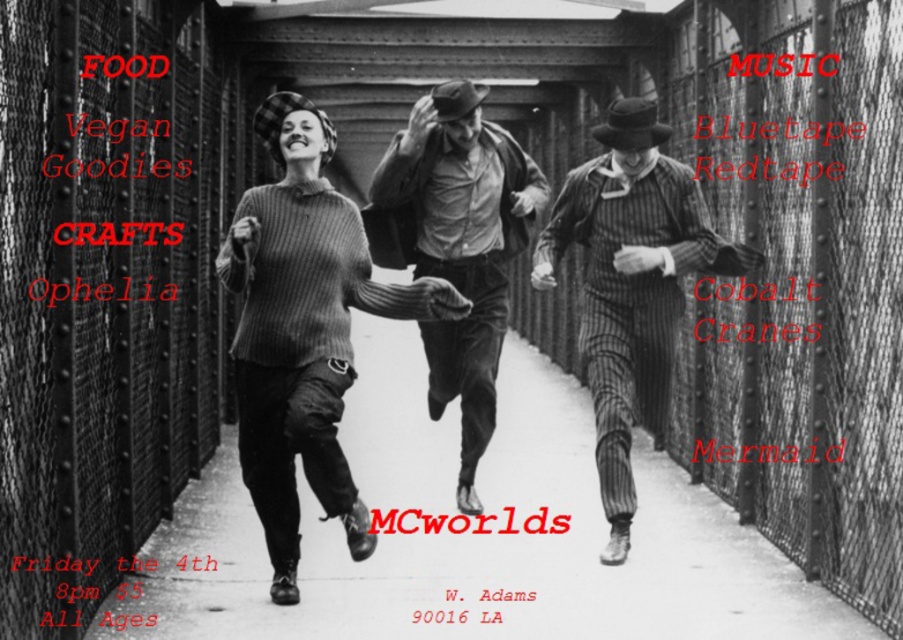
Between striped wool suit at center and smooth leather jacket at center, which one is positioned lower?

striped wool suit at center

Where is `striped wool suit at center`? The image size is (903, 640). striped wool suit at center is located at coordinates pos(631,285).

Locate an element on the screen. Image resolution: width=903 pixels, height=640 pixels. striped wool suit at center is located at coordinates (631, 285).

Which is above, knitted sweater at center or smooth leather jacket at center?

smooth leather jacket at center

Does knitted sweater at center have a lesser width compared to smooth leather jacket at center?

No.

Is point (278, 531) behind point (419, 170)?

No.

The image size is (903, 640). Identify the location of knitted sweater at center. (304, 330).

Can you confirm if knitted sweater at center is wider than striped wool suit at center?

Correct, the width of knitted sweater at center exceeds that of striped wool suit at center.

Which is in front, point (278, 115) or point (619, 102)?

Positioned in front is point (278, 115).

Locate an element on the screen. Image resolution: width=903 pixels, height=640 pixels. knitted sweater at center is located at coordinates (304, 330).